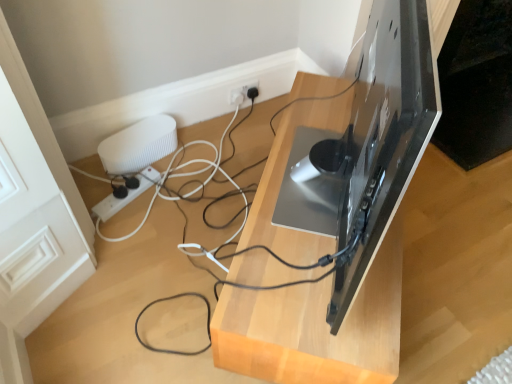
Where is `vacant space that is in between white plastic power strip at lower left and white ribbed speaker at left`? vacant space that is in between white plastic power strip at lower left and white ribbed speaker at left is located at coordinates (118, 188).